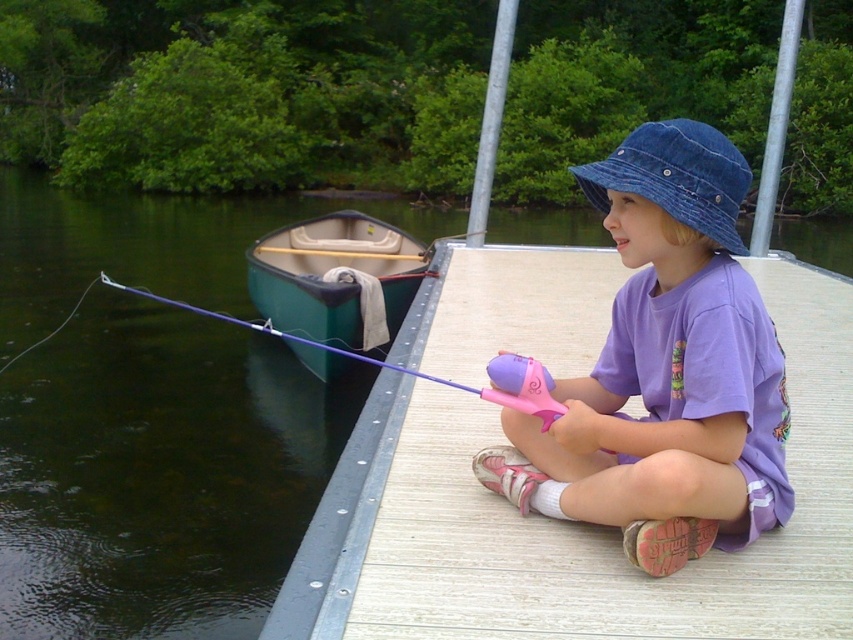
Does purple cotton shirt at center lie behind denim blue hat at upper center?

No.

Does point (656, 275) come behind point (735, 234)?

Yes.

Locate an element on the screen. The width and height of the screenshot is (853, 640). purple cotton shirt at center is located at coordinates (665, 369).

Is point (360, 336) positioned behind point (422, 374)?

Yes, point (360, 336) is farther from viewer.

Is green plastic canoe at center bigger than purple plastic fishing pole at left?

No, green plastic canoe at center is not bigger than purple plastic fishing pole at left.

I want to click on green plastic canoe at center, so click(335, 278).

In order to click on green plastic canoe at center in this screenshot , I will do `click(335, 278)`.

The image size is (853, 640). Identify the location of purple cotton shirt at center. (665, 369).

Can you confirm if purple cotton shirt at center is thinner than purple plastic fishing pole at left?

Yes, purple cotton shirt at center is thinner than purple plastic fishing pole at left.

Locate an element on the screen. The width and height of the screenshot is (853, 640). purple cotton shirt at center is located at coordinates (665, 369).

Locate an element on the screen. purple cotton shirt at center is located at coordinates (665, 369).